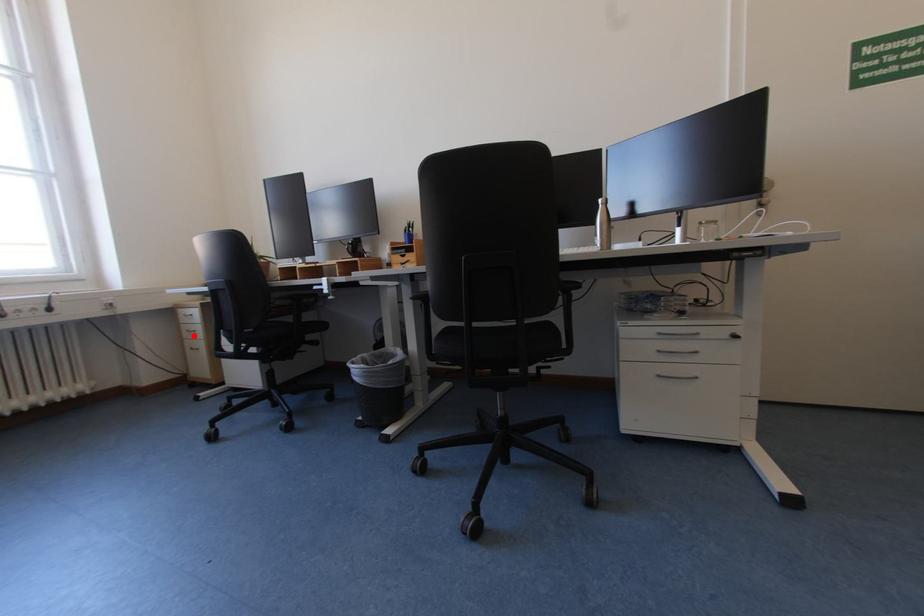
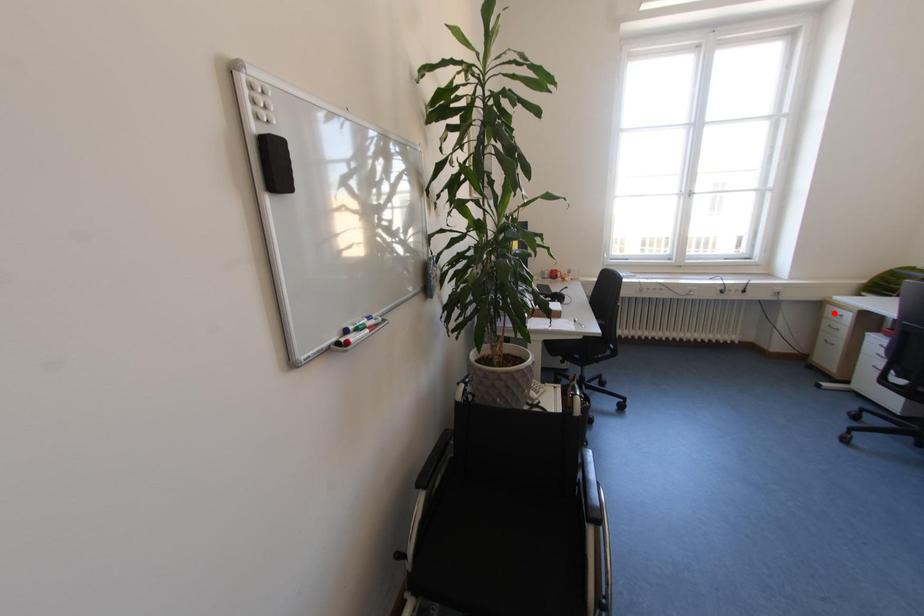
I am providing you with two images of the same scene from different viewpoints. A red point is marked on the first image and another point is marked on the second image. Is the marked point in image1 the same physical position as the marked point in image2?

No